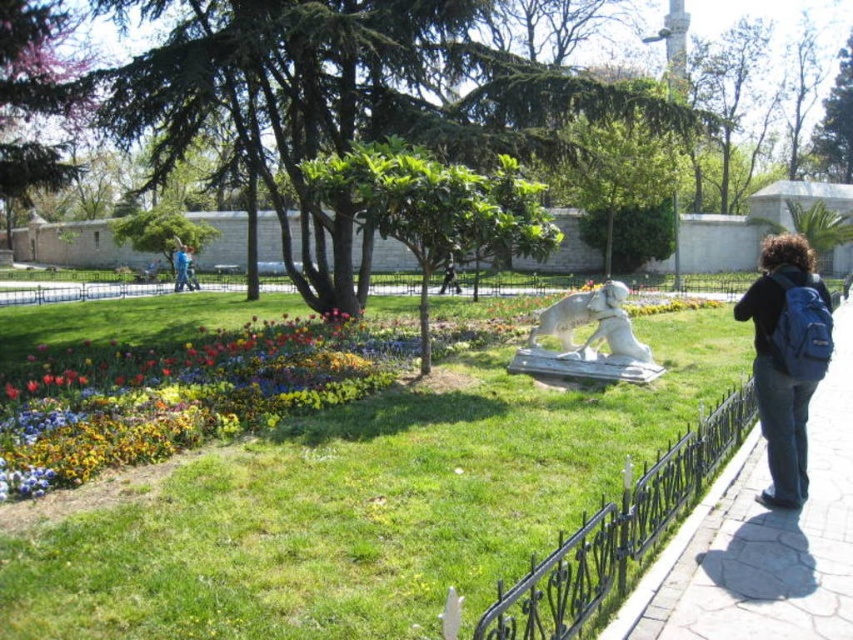
Question: Among these points, which one is nearest to the camera?

Choices:
 (A) click(187, 266)
 (B) click(456, 288)

Answer: (B)

Question: Which object is farther from the camera taking this photo?

Choices:
 (A) dark blue backpack at center
 (B) smooth concrete pavement at lower right
 (C) blue backpack at right

Answer: (A)

Question: Which point appears closest to the camera in this image?

Choices:
 (A) (795, 387)
 (B) (460, 291)
 (C) (207, 502)
 (D) (187, 276)

Answer: (C)

Question: Does smooth concrete pavement at lower right have a smaller size compared to blue denim jeans at lower left?

Choices:
 (A) no
 (B) yes

Answer: (B)

Question: Does smooth concrete pavement at lower right have a larger size compared to blue backpack at right?

Choices:
 (A) yes
 (B) no

Answer: (B)

Question: Can you confirm if white marble statue at center is wider than blue denim jeans at lower left?

Choices:
 (A) yes
 (B) no

Answer: (B)